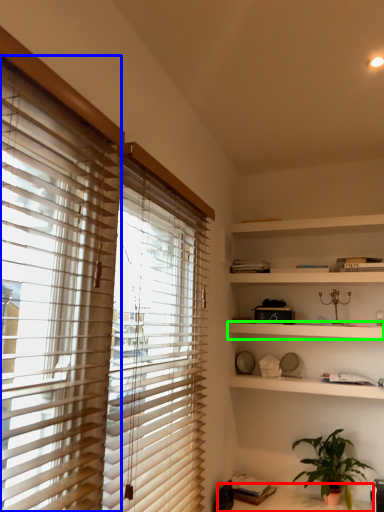
Question: Based on their relative distances, which object is nearer to table (highlighted by a red box)? Choose from window blind (highlighted by a blue box) and shelf (highlighted by a green box).

Choices:
 (A) window blind
 (B) shelf

Answer: (B)